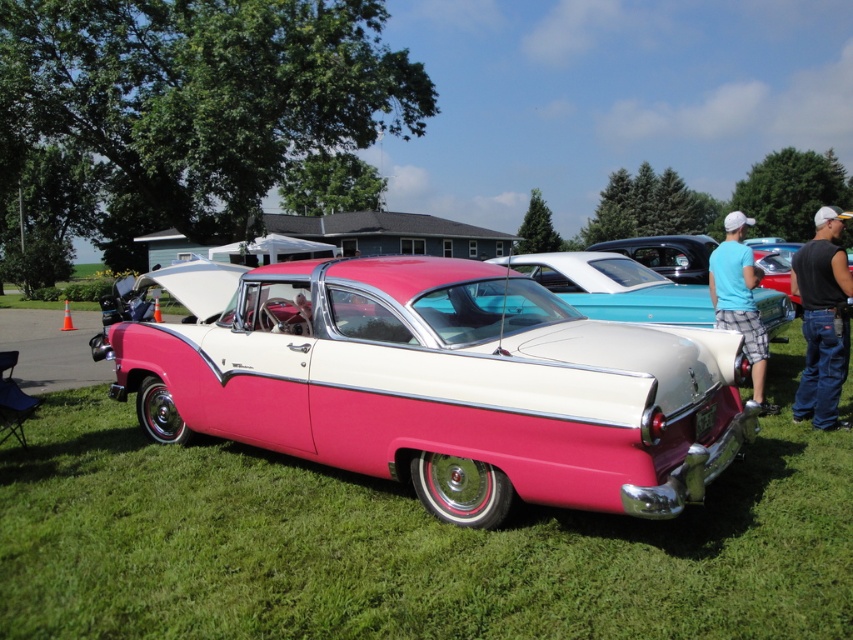
Question: Which is nearer to the black sleeveless shirt at right?

Choices:
 (A) blue cotton shirt at right
 (B) green grass at center

Answer: (A)

Question: Is pink glossy car at center behind blue cotton shirt at right?

Choices:
 (A) yes
 (B) no

Answer: (B)

Question: Can you confirm if green grass at center is smaller than blue cotton shirt at right?

Choices:
 (A) no
 (B) yes

Answer: (B)

Question: Based on their relative distances, which object is nearer to the green grass at center?

Choices:
 (A) pink glossy car at center
 (B) blue cotton shirt at right

Answer: (A)

Question: Which point is farther from the camera taking this photo?

Choices:
 (A) (341, 528)
 (B) (579, 396)

Answer: (A)

Question: Is green grass at center wider than blue cotton shirt at right?

Choices:
 (A) no
 (B) yes

Answer: (A)